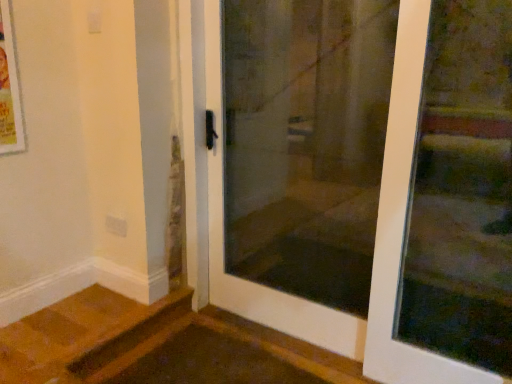
Question: Is transparent glass screen door at center at the right side of transparent glass door at upper right, which is the second door from left to right?

Choices:
 (A) no
 (B) yes

Answer: (A)

Question: Is transparent glass door at upper right, which is the second door from left to right, completely or partially inside transparent glass screen door at center?

Choices:
 (A) no
 (B) yes

Answer: (A)

Question: Is transparent glass screen door at center wider than transparent glass door at upper right, placed as the first door when sorted from right to left?

Choices:
 (A) yes
 (B) no

Answer: (A)

Question: Can you confirm if transparent glass screen door at center is shorter than transparent glass door at upper right, placed as the first door when sorted from right to left?

Choices:
 (A) yes
 (B) no

Answer: (B)

Question: Considering the relative positions of transparent glass screen door at center and transparent glass door at upper right, placed as the first door when sorted from right to left, in the image provided, is transparent glass screen door at center behind transparent glass door at upper right, placed as the first door when sorted from right to left,?

Choices:
 (A) yes
 (B) no

Answer: (A)

Question: From the image's perspective, is transparent glass screen door at center on transparent glass door at upper right, which is the second door from left to right?

Choices:
 (A) yes
 (B) no

Answer: (A)

Question: Can you confirm if transparent glass door at upper right, placed as the first door when sorted from right to left, is taller than white glass door at center, which ranks as the first door in left-to-right order?

Choices:
 (A) yes
 (B) no

Answer: (B)

Question: Is transparent glass door at upper right, which is the second door from left to right, closer to the viewer compared to white glass door at center, which ranks as the first door in left-to-right order?

Choices:
 (A) yes
 (B) no

Answer: (B)

Question: Is the surface of transparent glass door at upper right, which is the second door from left to right, in direct contact with white glass door at center, which is the second door in right-to-left order?

Choices:
 (A) no
 (B) yes

Answer: (A)

Question: Can you confirm if transparent glass door at upper right, placed as the first door when sorted from right to left, is thinner than white glass door at center, which is the second door in right-to-left order?

Choices:
 (A) yes
 (B) no

Answer: (A)

Question: From a real-world perspective, is transparent glass door at upper right, placed as the first door when sorted from right to left, located beneath white glass door at center, which is the second door in right-to-left order?

Choices:
 (A) yes
 (B) no

Answer: (A)

Question: Is transparent glass door at upper right, which is the second door from left to right, further to camera compared to white glass door at center, which is the second door in right-to-left order?

Choices:
 (A) yes
 (B) no

Answer: (A)

Question: From a real-world perspective, is transparent glass screen door at center located beneath white glass door at center, which is the second door in right-to-left order?

Choices:
 (A) no
 (B) yes

Answer: (B)